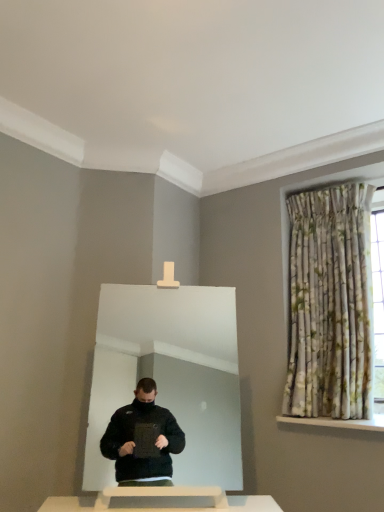
This screenshot has width=384, height=512. What do you see at coordinates (170, 376) in the screenshot?
I see `white glossy mirror at center` at bounding box center [170, 376].

Locate an element on the screen. white glossy mirror at center is located at coordinates (170, 376).

Find the location of a particular element. The image size is (384, 512). white glossy mirror at center is located at coordinates pos(170,376).